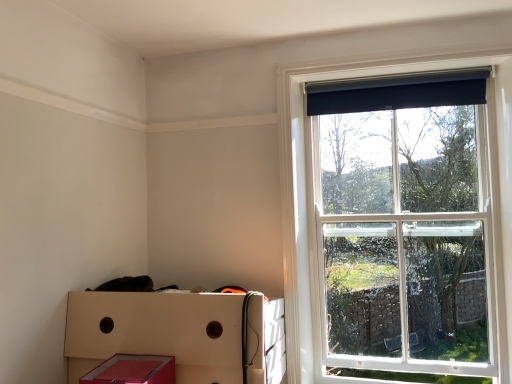
Question: Is matte red plastic crate at lower left taller than black roller blind at upper right?

Choices:
 (A) yes
 (B) no

Answer: (B)

Question: Considering the relative positions of matte red plastic crate at lower left and black roller blind at upper right in the image provided, is matte red plastic crate at lower left to the left of black roller blind at upper right from the viewer's perspective?

Choices:
 (A) no
 (B) yes

Answer: (B)

Question: Considering the relative sizes of matte red plastic crate at lower left and black roller blind at upper right in the image provided, is matte red plastic crate at lower left wider than black roller blind at upper right?

Choices:
 (A) yes
 (B) no

Answer: (A)

Question: Does matte red plastic crate at lower left come in front of black roller blind at upper right?

Choices:
 (A) yes
 (B) no

Answer: (A)

Question: From a real-world perspective, is matte red plastic crate at lower left under black roller blind at upper right?

Choices:
 (A) yes
 (B) no

Answer: (A)

Question: Is matte red plastic crate at lower left beside black roller blind at upper right?

Choices:
 (A) no
 (B) yes

Answer: (A)

Question: Does matte red plastic crate at lower left have a larger size compared to black fabric curtain at upper right?

Choices:
 (A) no
 (B) yes

Answer: (B)

Question: Is black fabric curtain at upper right at the back of matte red plastic crate at lower left?

Choices:
 (A) no
 (B) yes

Answer: (A)

Question: Can you confirm if matte red plastic crate at lower left is shorter than black fabric curtain at upper right?

Choices:
 (A) no
 (B) yes

Answer: (A)

Question: Can you confirm if matte red plastic crate at lower left is thinner than black fabric curtain at upper right?

Choices:
 (A) yes
 (B) no

Answer: (B)

Question: From the image's perspective, is matte red plastic crate at lower left over black fabric curtain at upper right?

Choices:
 (A) no
 (B) yes

Answer: (A)

Question: Could you tell me if matte red plastic crate at lower left is facing black fabric curtain at upper right?

Choices:
 (A) yes
 (B) no

Answer: (B)

Question: Does black fabric curtain at upper right have a greater width compared to matte red plastic crate at lower left?

Choices:
 (A) no
 (B) yes

Answer: (A)